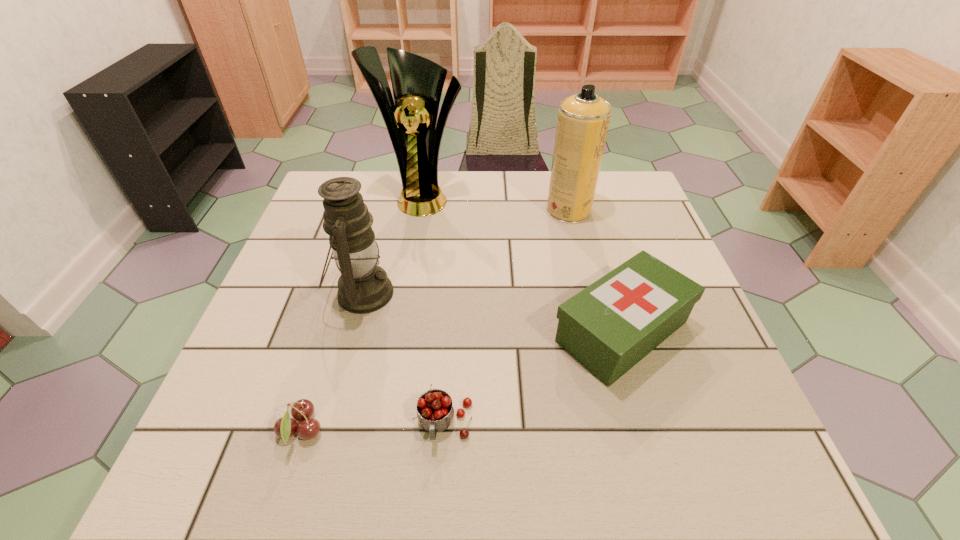
The height and width of the screenshot is (540, 960). Identify the location of free space located on the back of the first-aid kit. (594, 238).

Find the location of `vacant region located on the leaves of the shorter cherry`. vacant region located on the leaves of the shorter cherry is located at coordinates (434, 430).

At what (x,y) coordinates should I click in order to perform the action: click on award that is at the far edge. Please return your answer as a coordinate pair (x, y). The image size is (960, 540). Looking at the image, I should click on (417, 82).

Find the location of a particular element. Image resolution: width=960 pixels, height=540 pixels. aerosol can situated at the far edge is located at coordinates (583, 119).

I want to click on oil lamp present at the left edge, so click(363, 287).

You are a GUI agent. You are given a task and a screenshot of the screen. Output one action in this format:
    pyautogui.click(x=<x>, y=<y>)
    Task: Click on the cherry at the left edge
    The height and width of the screenshot is (540, 960).
    Given the screenshot: What is the action you would take?
    pyautogui.click(x=285, y=427)

The width and height of the screenshot is (960, 540). Identify the location of object situated at the right edge. click(611, 325).

The image size is (960, 540). What are the coordinates of `object located at the near left corner` in the screenshot? It's located at (285, 427).

In the image, there is a desktop. Where is `vacant space at the far edge`? The image size is (960, 540). vacant space at the far edge is located at coordinates (526, 186).

This screenshot has width=960, height=540. What are the coordinates of `vacant space at the near edge` in the screenshot? It's located at (570, 443).